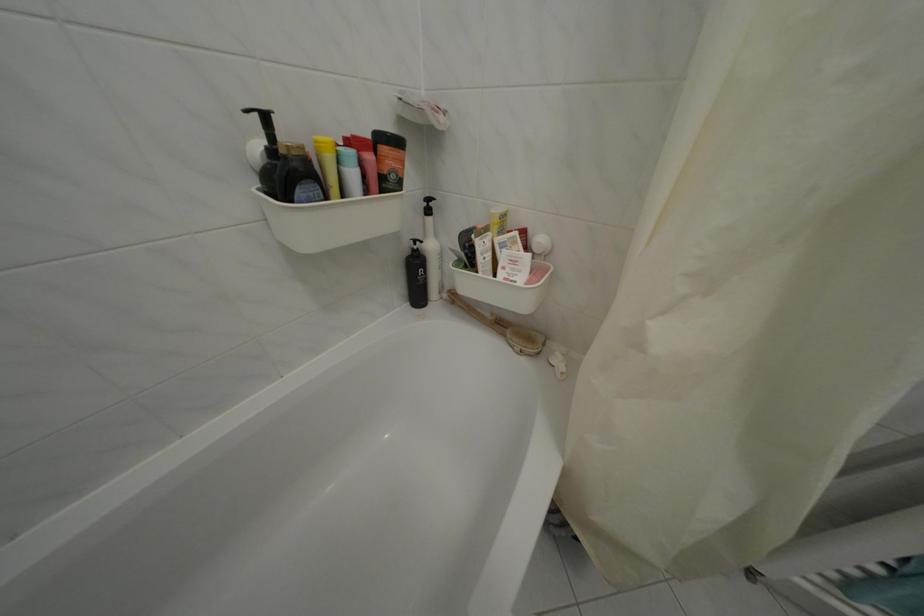
Which object does [503,328] point to?

It corresponds to the wooden back brush in the image.